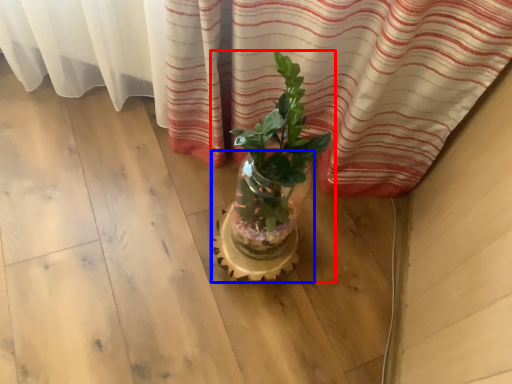
Question: Which object is further to the camera taking this photo, houseplant (highlighted by a red box) or flowerpot (highlighted by a blue box)?

Choices:
 (A) houseplant
 (B) flowerpot

Answer: (B)